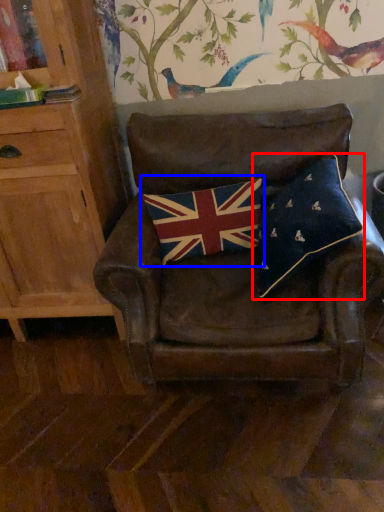
Question: Which object appears closest to the camera in this image, pillow (highlighted by a red box) or flag (highlighted by a blue box)?

Choices:
 (A) pillow
 (B) flag

Answer: (A)